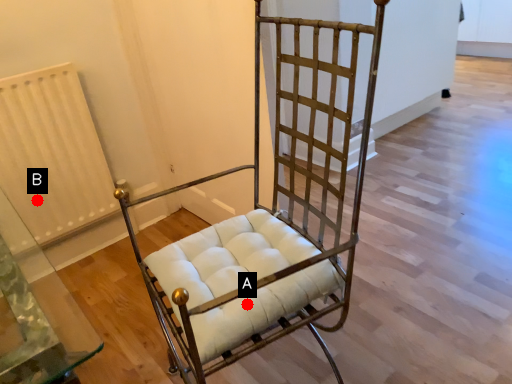
Question: Two points are circled on the image, labeled by A and B beside each circle. Which point is further to the camera?

Choices:
 (A) A is further
 (B) B is further

Answer: (B)